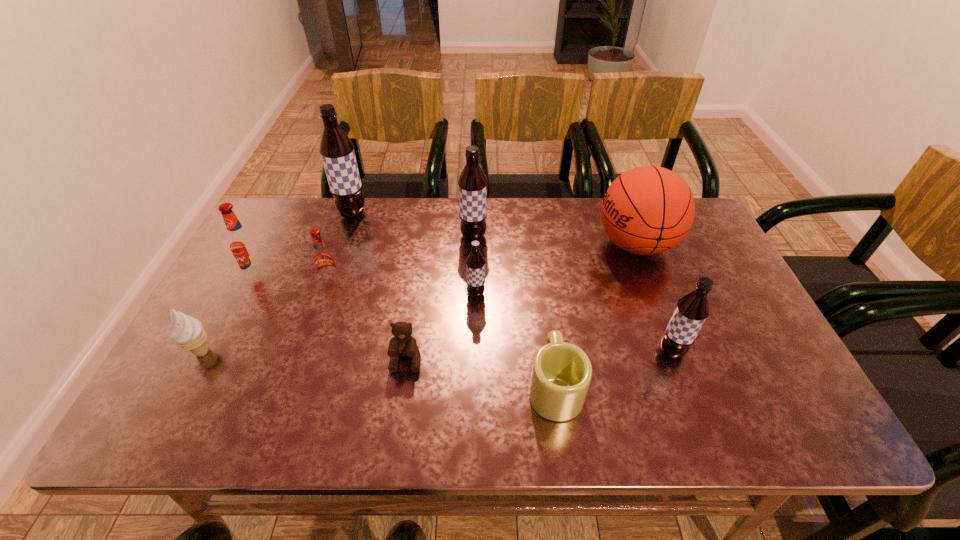
Locate which object ranks in proximity to the leftmost root beer. Please provide its 2D coordinates. Your answer should be formatted as a tuple, i.e. [(x, y)], where the tuple contains the x and y coordinates of a point satisfying the conditions above.

[(323, 258)]

Select which object appears as the sixth closest to the smaller red root beer. Please provide its 2D coordinates. Your answer should be formatted as a tuple, i.e. [(x, y)], where the tuple contains the x and y coordinates of a point satisfying the conditions above.

[(475, 263)]

Select which root beer is the fourth closest to the third farthest brown root beer. Please provide its 2D coordinates. Your answer should be formatted as a tuple, i.e. [(x, y)], where the tuple contains the x and y coordinates of a point satisfying the conditions above.

[(337, 152)]

Locate which root beer ranks fifth in proximity to the nearest root beer. Please provide its 2D coordinates. Your answer should be formatted as a tuple, i.e. [(x, y)], where the tuple contains the x and y coordinates of a point satisfying the conditions above.

[(242, 243)]

This screenshot has height=540, width=960. Find the location of `brown root beer that can be found as the closest to the third biggest brown root beer`. brown root beer that can be found as the closest to the third biggest brown root beer is located at coordinates (475, 263).

Locate an element on the screen. brown root beer that stands as the third closest to the beige mug is located at coordinates (472, 182).

The height and width of the screenshot is (540, 960). What are the coordinates of `vacant point that satisfies the following two spatial constraints: 1. on the front side of the second nearest brown root beer; 2. on the left side of the fifth nearest root beer` in the screenshot? It's located at (472, 294).